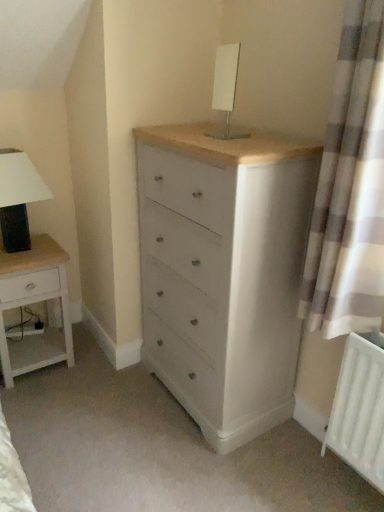
I want to click on free spot below matte black lampshade at left, which is the 2th table lamp from top to bottom (from a real-world perspective), so click(39, 246).